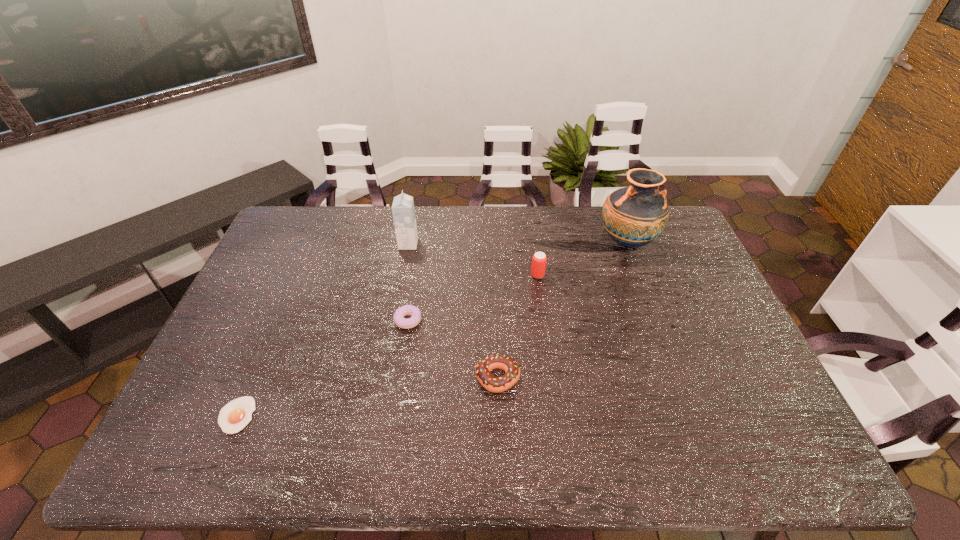
The height and width of the screenshot is (540, 960). Find the location of `the nearest object`. the nearest object is located at coordinates (234, 416).

This screenshot has height=540, width=960. In order to click on vacant region located 0.080m on the left of the pottery in this screenshot , I will do `click(573, 242)`.

This screenshot has height=540, width=960. In order to click on free space located 0.140m on the front label of the second tallest object in this screenshot , I will do `click(457, 244)`.

The image size is (960, 540). What are the coordinates of `vacant region located 0.180m on the front of the third farthest object` in the screenshot? It's located at (544, 322).

You are a GUI agent. You are given a task and a screenshot of the screen. Output one action in this format:
    pyautogui.click(x=<x>, y=<y>)
    Task: Click on the vacant space situated 0.210m on the back of the fourth object from left to right
    Image resolution: width=960 pixels, height=540 pixels.
    Given the screenshot: What is the action you would take?
    pyautogui.click(x=495, y=304)

Where is `free location located on the back of the shorter doughnut`? The image size is (960, 540). free location located on the back of the shorter doughnut is located at coordinates (415, 274).

Locate an element on the screen. Image resolution: width=960 pixels, height=540 pixels. free space located 0.050m on the back of the leftmost object is located at coordinates (252, 380).

Where is `pottery that is positioned at the far edge`? This screenshot has width=960, height=540. pottery that is positioned at the far edge is located at coordinates (633, 216).

Identify the location of carton that is at the far edge. (403, 211).

At what (x,y) coordinates should I click in order to perform the action: click on object that is at the near edge. Please return your answer as a coordinate pair (x, y). Image resolution: width=960 pixels, height=540 pixels. Looking at the image, I should click on coord(234,416).